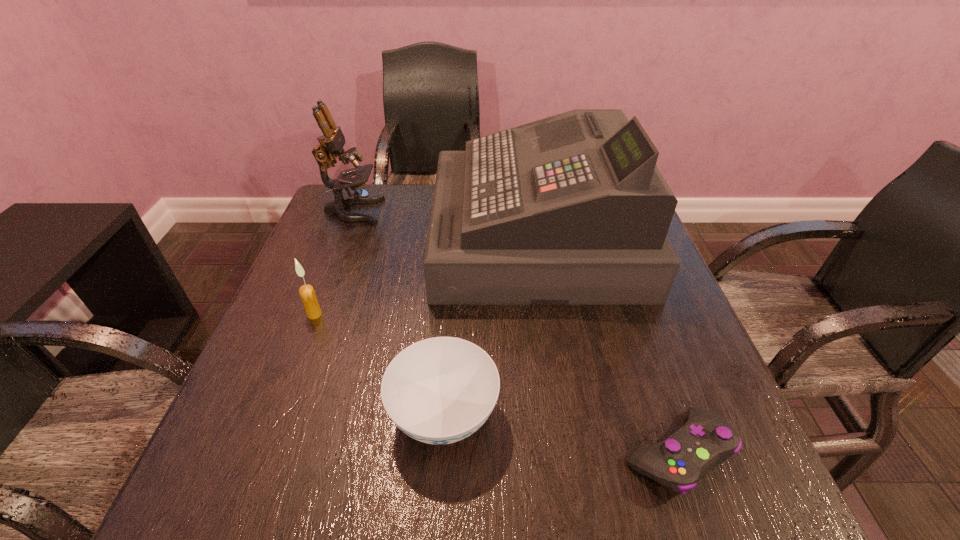
Where is `vacant region that satisfies the following two spatial constraints: 1. on the back side of the chinaware; 2. at the eyepieces of the microscope`? vacant region that satisfies the following two spatial constraints: 1. on the back side of the chinaware; 2. at the eyepieces of the microscope is located at coordinates (458, 211).

Identify the location of free region that satisfies the following two spatial constraints: 1. on the front-facing side of the cash register; 2. on the front side of the chinaware. The width and height of the screenshot is (960, 540). (564, 415).

Locate an element on the screen. This screenshot has height=540, width=960. free space that satisfies the following two spatial constraints: 1. at the eyepieces of the control; 2. on the left side of the microscope is located at coordinates (261, 453).

Locate an element on the screen. This screenshot has width=960, height=540. free spot that satisfies the following two spatial constraints: 1. on the front side of the shortest object; 2. on the left side of the fourth tallest object is located at coordinates (442, 453).

What are the coordinates of `free location that satisfies the following two spatial constraints: 1. on the back side of the control; 2. on the front-facing side of the cash register` in the screenshot? It's located at (603, 237).

Where is `vacant area in the image that satisfies the following two spatial constraints: 1. at the eyepieces of the control; 2. on the right side of the microscope`? The height and width of the screenshot is (540, 960). vacant area in the image that satisfies the following two spatial constraints: 1. at the eyepieces of the control; 2. on the right side of the microscope is located at coordinates (261, 453).